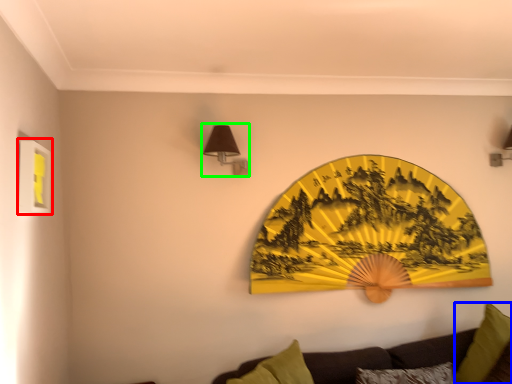
Question: Which object is the closest to the picture frame (highlighted by a red box)? Choose among these: pillow (highlighted by a blue box) or lamp (highlighted by a green box).

Choices:
 (A) pillow
 (B) lamp

Answer: (B)